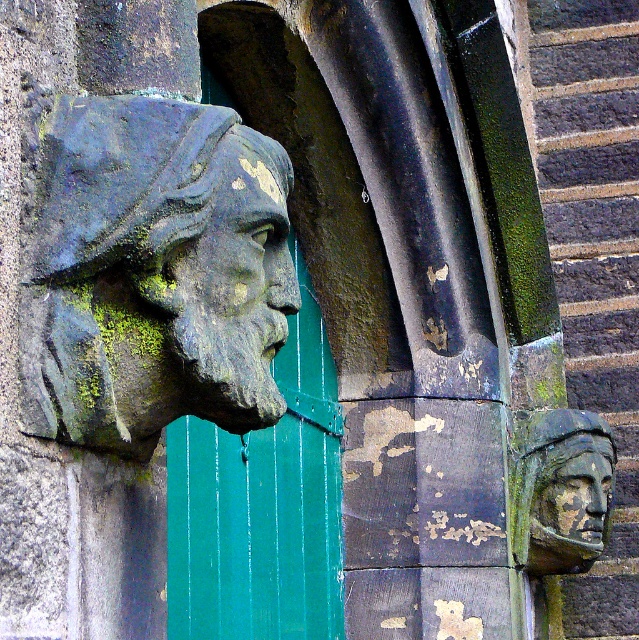
You are an architect examining a stone carving on a building facade. You observe the green mossy stone face at upper left. Can you determine its exact coordinates within the image frame?

The green mossy stone face at upper left is located at coordinates point [220,308].

You are an architect examining the stone carving and the green painted wood door at center. Based on their positions, which object is closer to the viewer?

The green painted wood door at center is located at point [261,506], so it is closer to the viewer than the stone carving.